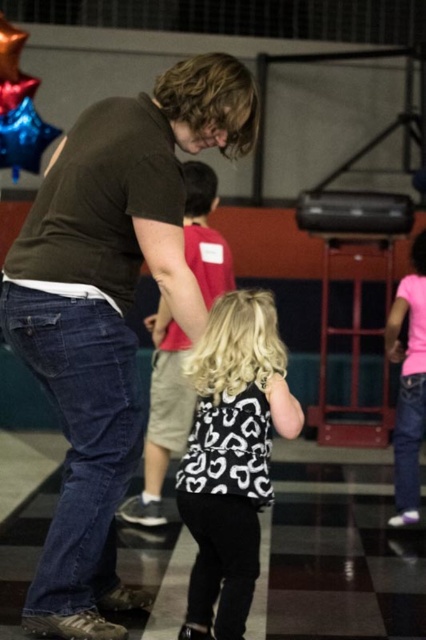
You are organizing a clothing donation drive and need to sort items by size. You come across the matte brown shirt at center and the black matte dress at center. Which item should you place in the large size bin?

The matte brown shirt at center is bigger than the black matte dress at center, so it should be placed in the large size bin.